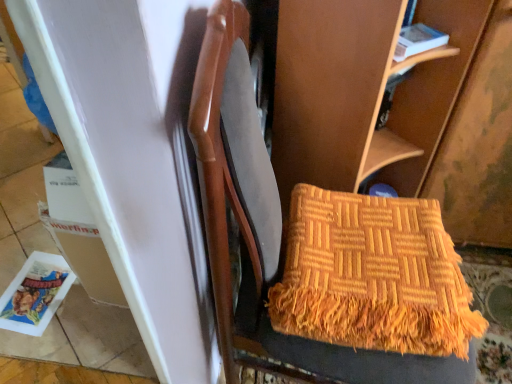
Question: Can you confirm if white paper magazine at upper right, placed as the second magazine when sorted from back to front, is positioned to the left of orange woven blanket at center?

Choices:
 (A) yes
 (B) no

Answer: (B)

Question: Can you confirm if white paper magazine at upper right, the 1th magazine viewed from the front, is shorter than orange woven blanket at center?

Choices:
 (A) no
 (B) yes

Answer: (B)

Question: Does white paper magazine at upper right, the 1th magazine viewed from the front, have a greater height compared to orange woven blanket at center?

Choices:
 (A) yes
 (B) no

Answer: (B)

Question: Is white paper magazine at upper right, placed as the second magazine when sorted from back to front, positioned beyond the bounds of orange woven blanket at center?

Choices:
 (A) yes
 (B) no

Answer: (A)

Question: Is white paper magazine at upper right, placed as the 2th magazine when sorted from bottom to top, next to orange woven blanket at center and touching it?

Choices:
 (A) yes
 (B) no

Answer: (B)

Question: Does point (439, 41) appear closer or farther from the camera than point (49, 314)?

Choices:
 (A) farther
 (B) closer

Answer: (B)

Question: In terms of height, does white paper magazine at upper right, which appears as the 2th magazine when viewed from the left, look taller or shorter compared to matte plastic magazine at lower left, the 2th magazine from the right?

Choices:
 (A) tall
 (B) short

Answer: (A)

Question: Is white paper magazine at upper right, placed as the second magazine when sorted from back to front, wider or thinner than matte plastic magazine at lower left, the first magazine positioned from the left?

Choices:
 (A) wide
 (B) thin

Answer: (B)

Question: Visually, is white paper magazine at upper right, arranged as the first magazine when viewed from the top, positioned to the left or to the right of matte plastic magazine at lower left, which is the 1th magazine in bottom-to-top order?

Choices:
 (A) right
 (B) left

Answer: (A)

Question: In terms of height, does orange woven blanket at center look taller or shorter compared to matte plastic magazine at lower left, the 2th magazine from the right?

Choices:
 (A) short
 (B) tall

Answer: (B)

Question: Considering the relative positions of orange woven blanket at center and matte plastic magazine at lower left, the 2th magazine in the front-to-back sequence, in the image provided, is orange woven blanket at center to the left or to the right of matte plastic magazine at lower left, the 2th magazine in the front-to-back sequence,?

Choices:
 (A) left
 (B) right

Answer: (B)

Question: Is orange woven blanket at center wider or thinner than matte plastic magazine at lower left, which is the 1th magazine in bottom-to-top order?

Choices:
 (A) wide
 (B) thin

Answer: (A)

Question: From a real-world perspective, is orange woven blanket at center above or below matte plastic magazine at lower left, which is the 1th magazine in bottom-to-top order?

Choices:
 (A) above
 (B) below

Answer: (A)

Question: Does point (34, 296) appear closer or farther from the camera than point (420, 24)?

Choices:
 (A) closer
 (B) farther

Answer: (B)

Question: From the image's perspective, is matte plastic magazine at lower left, which is counted as the second magazine, starting from the top, above or below white paper magazine at upper right, which ranks as the first magazine in right-to-left order?

Choices:
 (A) below
 (B) above

Answer: (A)